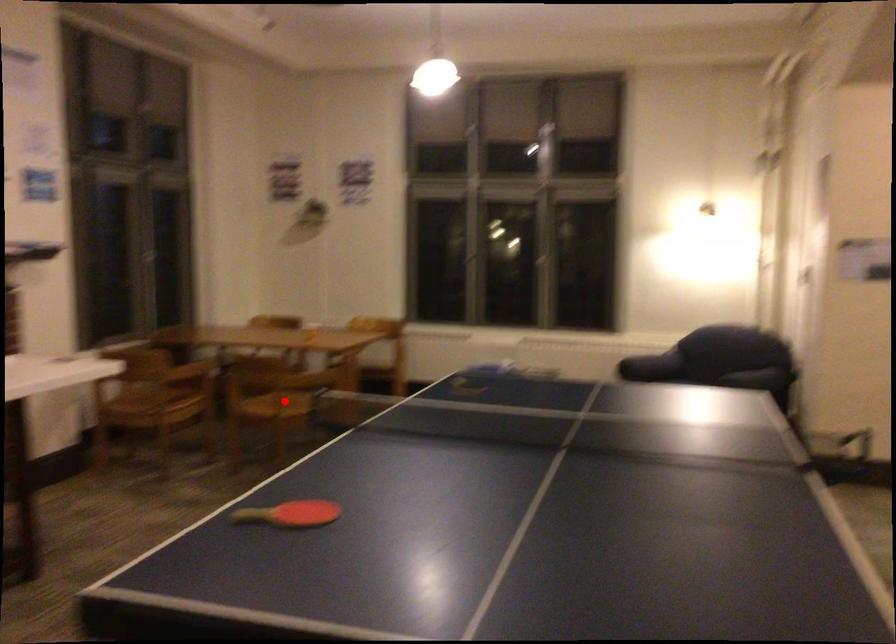
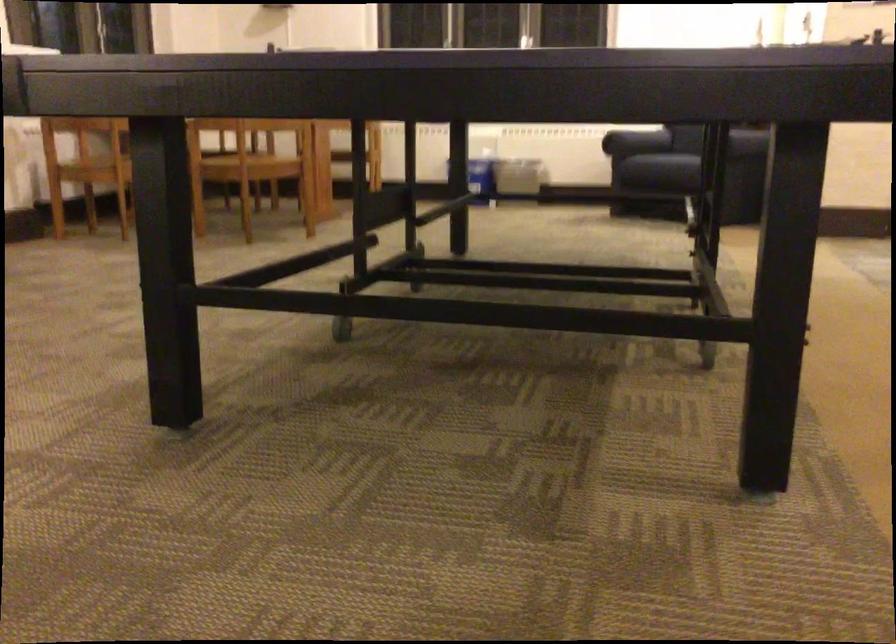
Where in the second image is the point corresponding to the highlighted location from the first image?

(248, 160)